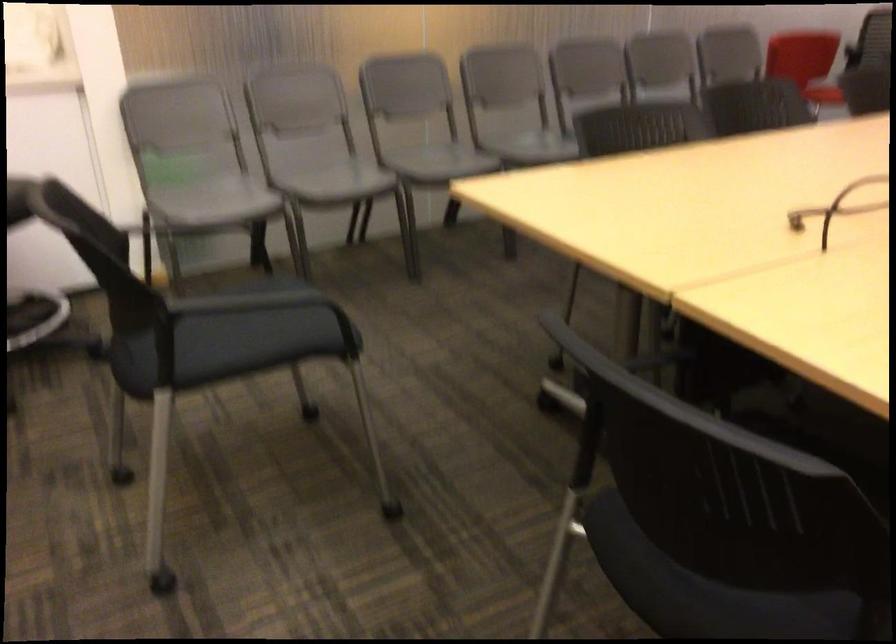
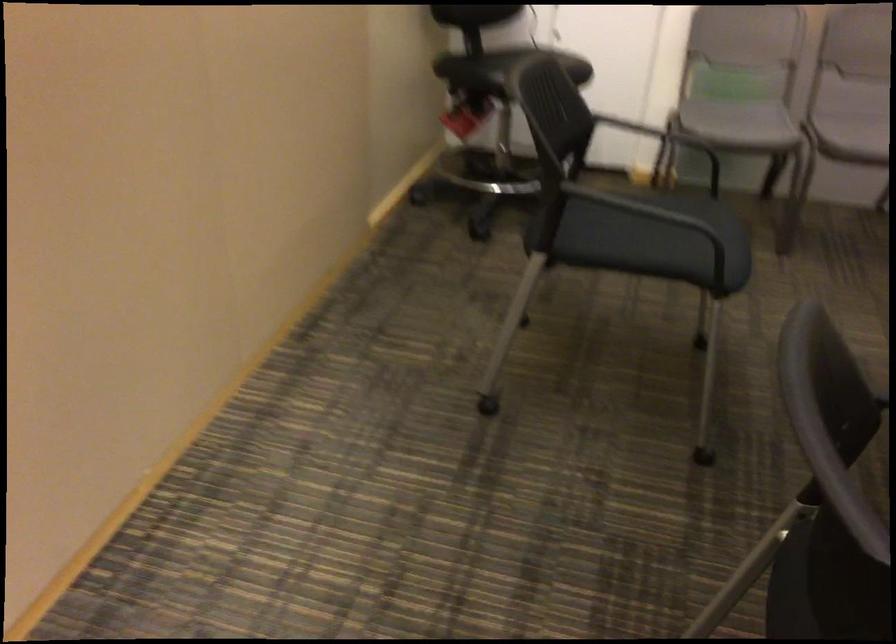
The point at (309, 175) is marked in the first image. Where is the corresponding point in the second image?

(853, 128)